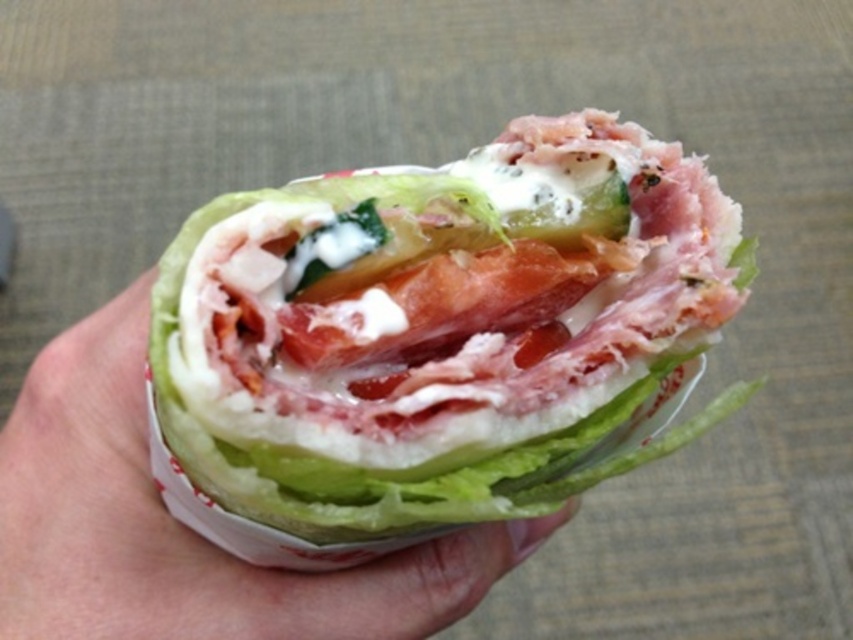
Measure the distance between shiny white wrap at center and white paper at center.

5.65 inches

Describe the element at coordinates (440, 326) in the screenshot. Image resolution: width=853 pixels, height=640 pixels. I see `shiny white wrap at center` at that location.

Identify the location of shiny white wrap at center. (440, 326).